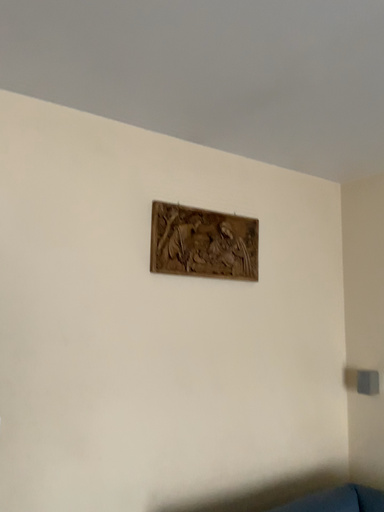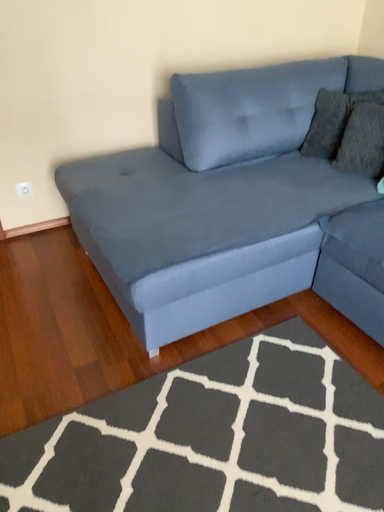
Question: How did the camera likely rotate when shooting the video?

Choices:
 (A) rotated upward
 (B) rotated downward

Answer: (B)